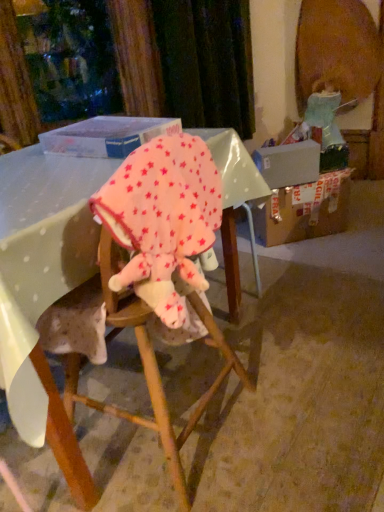
Image resolution: width=384 pixels, height=512 pixels. Find the location of `vacant area that lies to the right of brown cardboard box at right`. vacant area that lies to the right of brown cardboard box at right is located at coordinates (358, 223).